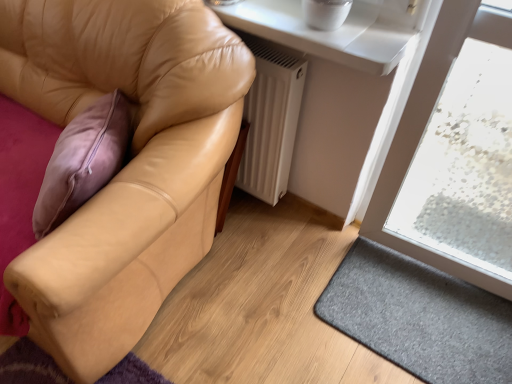
Question: Is gray felt doormat at lower right smaller than white glossy window sill at upper center?

Choices:
 (A) no
 (B) yes

Answer: (B)

Question: Is gray felt doormat at lower right oriented away from white glossy window sill at upper center?

Choices:
 (A) no
 (B) yes

Answer: (A)

Question: Does gray felt doormat at lower right have a lesser height compared to white glossy window sill at upper center?

Choices:
 (A) no
 (B) yes

Answer: (B)

Question: Is the position of gray felt doormat at lower right more distant than that of white glossy window sill at upper center?

Choices:
 (A) no
 (B) yes

Answer: (B)

Question: Is gray felt doormat at lower right far away from white glossy window sill at upper center?

Choices:
 (A) no
 (B) yes

Answer: (A)

Question: Is point (285, 97) closer or farther from the camera than point (295, 14)?

Choices:
 (A) closer
 (B) farther

Answer: (B)

Question: Looking at their shapes, would you say white matte radiator at lower center is wider or thinner than white glossy window sill at upper center?

Choices:
 (A) wide
 (B) thin

Answer: (B)

Question: In the image, is white matte radiator at lower center positioned in front of or behind white glossy window sill at upper center?

Choices:
 (A) front
 (B) behind

Answer: (B)

Question: In the image, is white matte radiator at lower center on the left side or the right side of white glossy window sill at upper center?

Choices:
 (A) right
 (B) left

Answer: (B)

Question: From the image's perspective, is gray felt doormat at lower right above or below tan leather couch at left?

Choices:
 (A) above
 (B) below

Answer: (B)

Question: Is gray felt doormat at lower right situated inside tan leather couch at left or outside?

Choices:
 (A) inside
 (B) outside

Answer: (B)

Question: In terms of width, does gray felt doormat at lower right look wider or thinner when compared to tan leather couch at left?

Choices:
 (A) thin
 (B) wide

Answer: (A)

Question: In terms of height, does gray felt doormat at lower right look taller or shorter compared to tan leather couch at left?

Choices:
 (A) tall
 (B) short

Answer: (B)

Question: In terms of size, does tan leather couch at left appear bigger or smaller than white glossy window sill at upper center?

Choices:
 (A) big
 (B) small

Answer: (A)

Question: In the image, is tan leather couch at left positioned in front of or behind white glossy window sill at upper center?

Choices:
 (A) front
 (B) behind

Answer: (A)